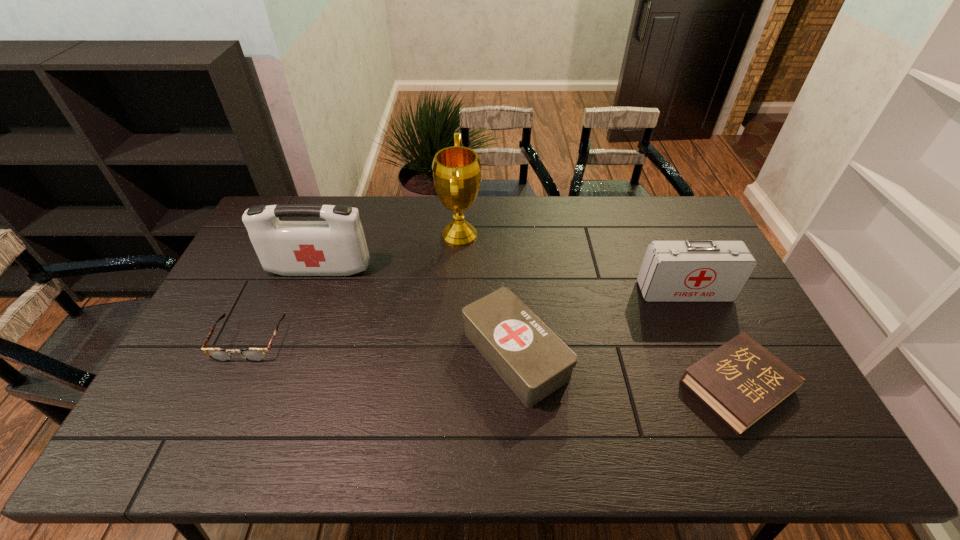
I want to click on hardback book located in the right edge section of the desktop, so click(x=741, y=381).

Identify the location of object positioned at the near right corner. (741, 381).

At what (x,y) coordinates should I click in order to perform the action: click on vacant space at the far edge of the desktop. Please return your answer as a coordinate pair (x, y). Looking at the image, I should click on [x=550, y=195].

Find the location of `vacant space at the near edge of the desktop`. vacant space at the near edge of the desktop is located at coordinates (239, 437).

Locate an element on the screen. This screenshot has width=960, height=540. free region at the left edge of the desktop is located at coordinates (261, 267).

I want to click on vacant area at the right edge, so click(x=795, y=410).

The image size is (960, 540). I want to click on vacant space at the far right corner of the desktop, so coord(655,195).

The width and height of the screenshot is (960, 540). I want to click on free space between the rightmost first-aid kit and the third shortest object, so click(x=600, y=322).

You are a GUI agent. You are given a task and a screenshot of the screen. Output one action in this format:
    pyautogui.click(x=<x>, y=<y>)
    Task: Click on the empty location between the second first-aid kit from left to right and the fourth nearest object
    This screenshot has width=960, height=540.
    Given the screenshot: What is the action you would take?
    pyautogui.click(x=600, y=322)

This screenshot has width=960, height=540. In order to click on empty location between the fourth shortest object and the tallest object in this screenshot , I will do `click(572, 263)`.